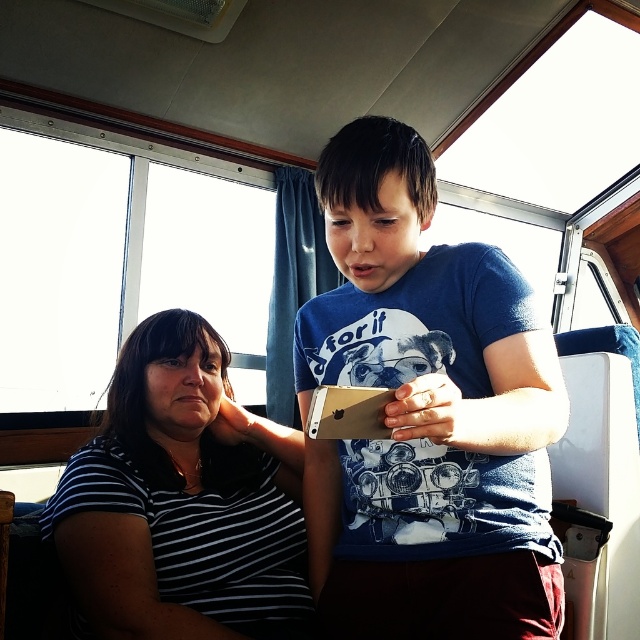
Question: Is blue cotton shirt at center further to camera compared to black striped shirt at left?

Choices:
 (A) yes
 (B) no

Answer: (B)

Question: Is blue cotton shirt at center to the left of black striped shirt at left from the viewer's perspective?

Choices:
 (A) no
 (B) yes

Answer: (A)

Question: Considering the relative positions of blue cotton shirt at center and black striped shirt at left in the image provided, where is blue cotton shirt at center located with respect to black striped shirt at left?

Choices:
 (A) left
 (B) right

Answer: (B)

Question: Which point is farther to the camera?

Choices:
 (A) click(422, 305)
 (B) click(276, 580)

Answer: (B)

Question: Which point is closer to the camera?

Choices:
 (A) blue cotton shirt at center
 (B) black striped shirt at left

Answer: (A)